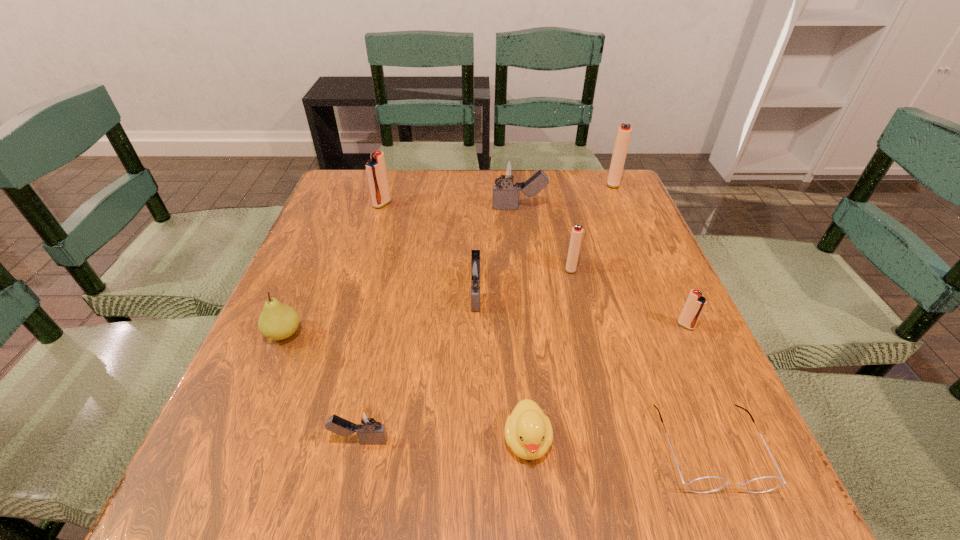
The image size is (960, 540). I want to click on pear, so click(x=277, y=321).

In order to click on the leftmost object in this screenshot , I will do `click(277, 321)`.

Find the location of `the nearest red igniter`. the nearest red igniter is located at coordinates (695, 304).

This screenshot has width=960, height=540. I want to click on the sixth farthest igniter, so click(695, 304).

Locate an element on the screen. Image resolution: width=960 pixels, height=540 pixels. the third object from left to right is located at coordinates (367, 424).

In order to click on the leftmost gray igniter in this screenshot , I will do `click(367, 424)`.

You are a GUI agent. You are given a task and a screenshot of the screen. Output one action in this format:
    pyautogui.click(x=<x>, y=<y>)
    Task: Click on the yellow duckling
    
    Given the screenshot: What is the action you would take?
    pyautogui.click(x=528, y=431)

Locate an element on the screen. The width and height of the screenshot is (960, 540). the shortest object is located at coordinates (708, 484).

What are the coordinates of `spectacles` in the screenshot? It's located at (708, 484).

Where is `vacant space located on the front of the farthest igniter`? The image size is (960, 540). vacant space located on the front of the farthest igniter is located at coordinates (639, 242).